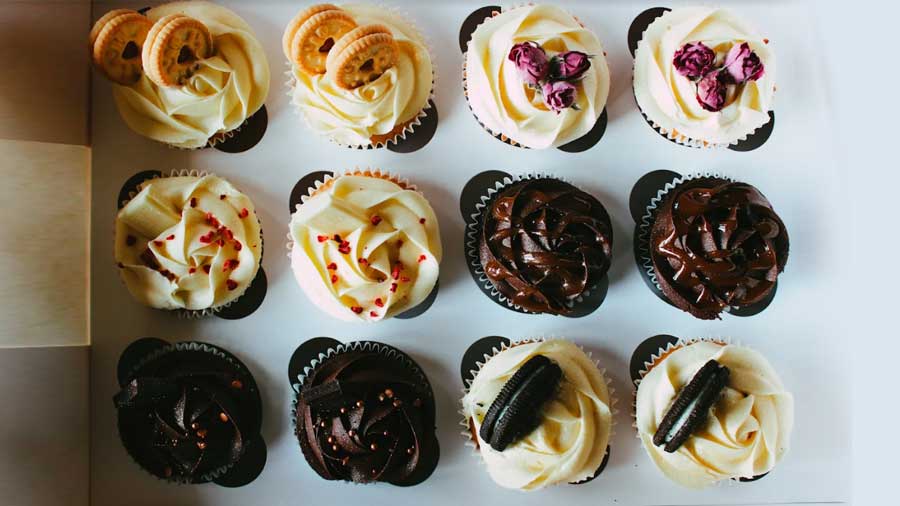
Locate an element on the screen. The width and height of the screenshot is (900, 506). box is located at coordinates (47, 75), (266, 344).